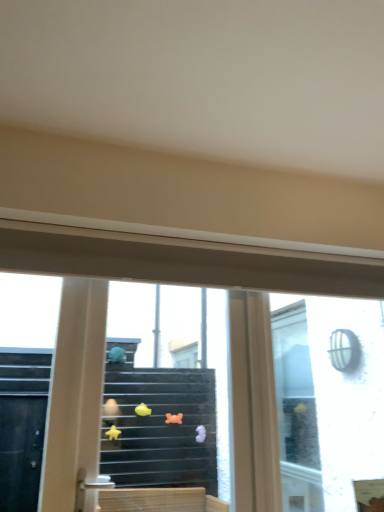
The height and width of the screenshot is (512, 384). Identify the location of transparent glass window at center. (184, 260).

This screenshot has width=384, height=512. Describe the element at coordinates (184, 260) in the screenshot. I see `transparent glass window at center` at that location.

Where is `transparent glass window at center`? This screenshot has width=384, height=512. transparent glass window at center is located at coordinates (184, 260).